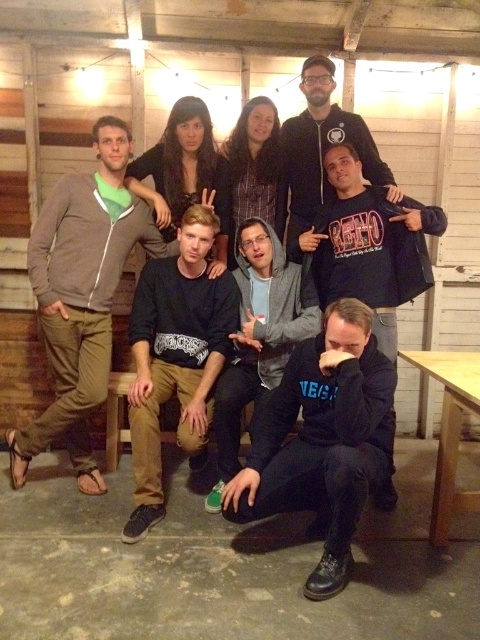
You are a photographer at the event and need to ensure that both the black cotton sweater at center and the black hoodie at lower right are visible in the group photo. Given their sizes, which one might require more space in the frame?

The black cotton sweater at center is larger in size compared to the black hoodie at lower right, so it might require more space in the frame to fully capture its details.